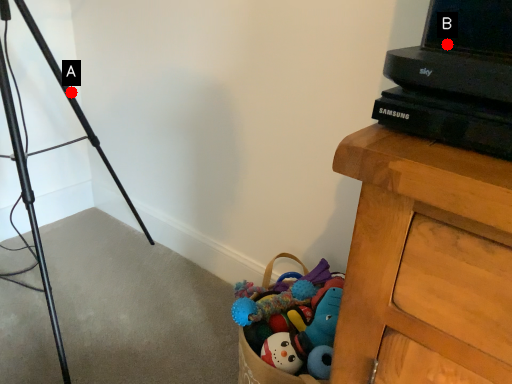
Question: Two points are circled on the image, labeled by A and B beside each circle. Which of the following is the closest to the observer?

Choices:
 (A) A is closer
 (B) B is closer

Answer: (B)